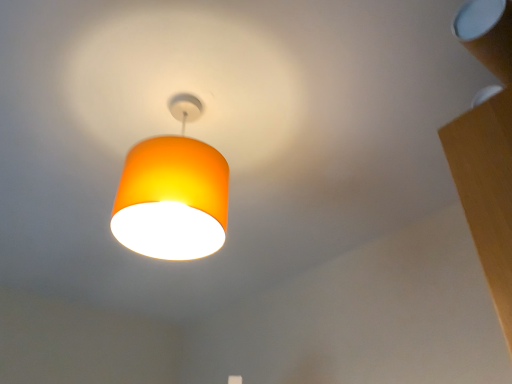
What do you see at coordinates (173, 193) in the screenshot? I see `orange fabric lampshade at upper center` at bounding box center [173, 193].

In order to face orange fabric lampshade at upper center, should I rotate leftwards or rightwards?

A 10.130 degree turn to the left will do.

What is the approximate height of orange fabric lampshade at upper center?

It is 40.79 centimeters.

Locate an element on the screen. Image resolution: width=512 pixels, height=384 pixels. orange fabric lampshade at upper center is located at coordinates (173, 193).

Image resolution: width=512 pixels, height=384 pixels. Identify the location of orange fabric lampshade at upper center. (173, 193).